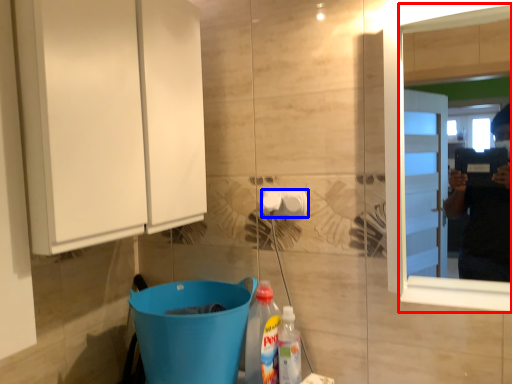
Question: Which object is closer to the camera taking this photo, mirror (highlighted by a red box) or towel bar (highlighted by a blue box)?

Choices:
 (A) mirror
 (B) towel bar

Answer: (A)